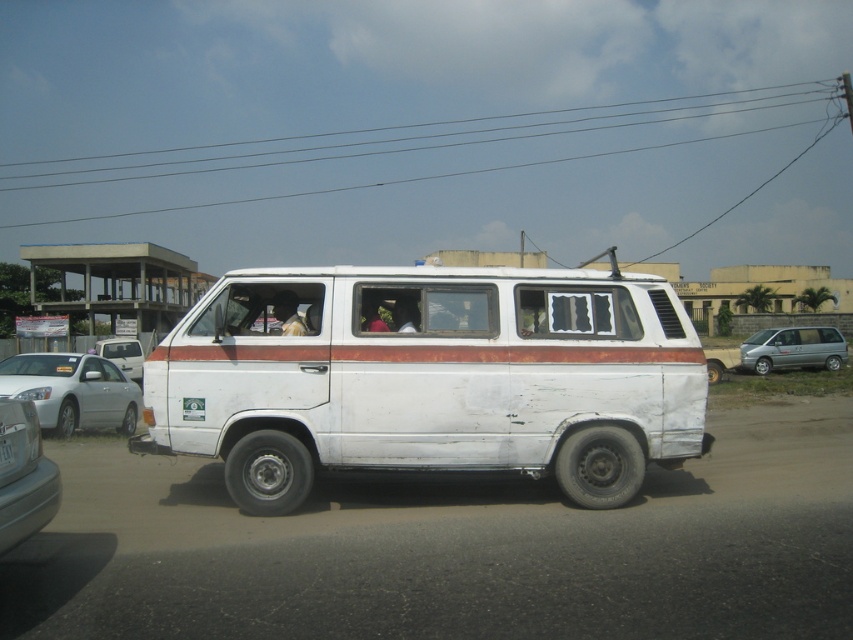
You are standing at the origin point of the coordinate system. You need to locate the white matte van at center. What are its coordinates?

The white matte van at center is located at point (x=428, y=378).

You are a delivery person trying to park your truck next to the silver metallic sedan at left and the white plastic license plate at center. Based on their widths, which vehicle should you avoid parking next to to ensure enough space?

The silver metallic sedan at left might be wider than the white plastic license plate at center, so you should avoid parking next to the silver metallic sedan at left to ensure enough space.